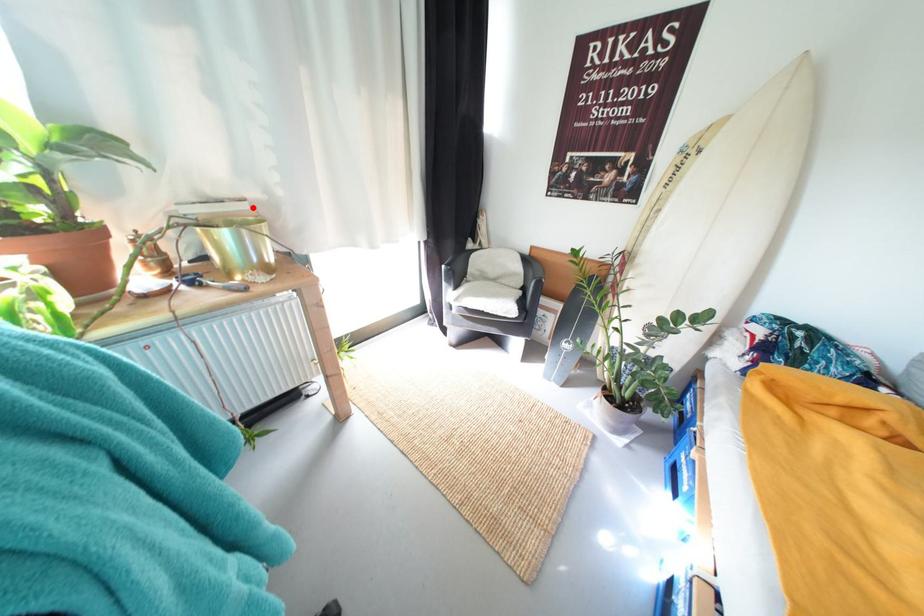
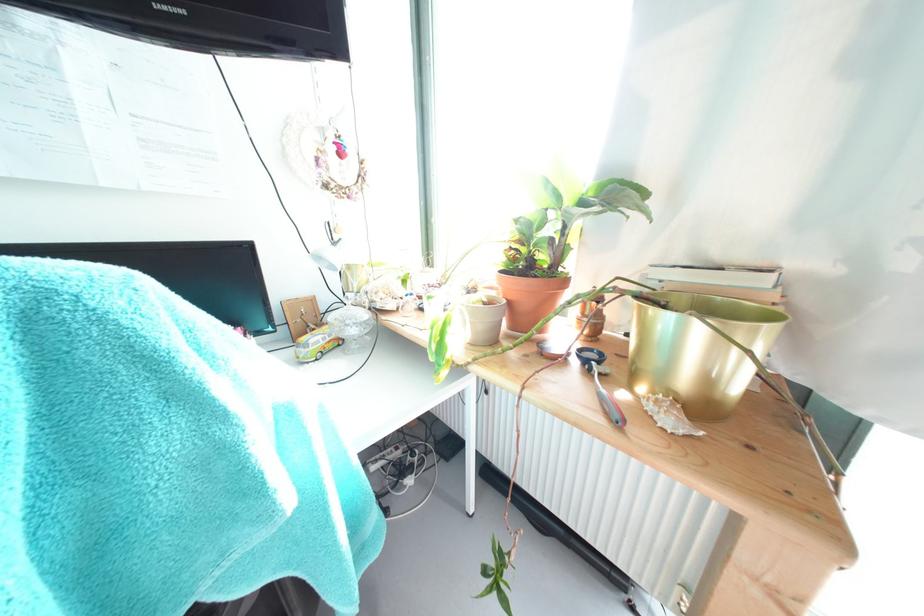
The point at the highlighted location is marked in the first image. Where is the corresponding point in the second image?

(771, 283)